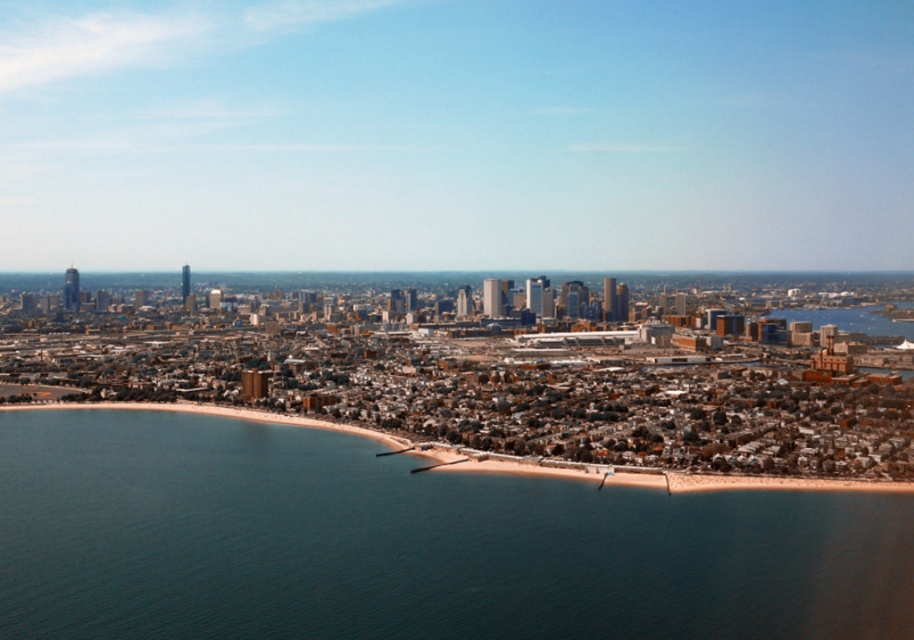
You are standing on the smooth sand beach at lower center and want to reach the blue water at lower left. Which direction should you walk to get there?

You should walk to the left to reach the blue water at lower left since it is located to the left of the smooth sand beach at lower center.

You are a lifeguard standing on the beach and need to reach the water quickly. Given that you can run at a speed of 8 meters per second, how many seconds will it take you to reach the blue water at lower left from the smooth sand beach at lower center?

The distance between the blue water at lower left and the smooth sand beach at lower center is 52.80 meters. At a running speed of 8 meters per second, dividing the distance by the speed gives 52.80 divided by 8 equals 6.6 seconds. Therefore, it will take 6.6 seconds to reach the blue water at lower left from the smooth sand beach at lower center.